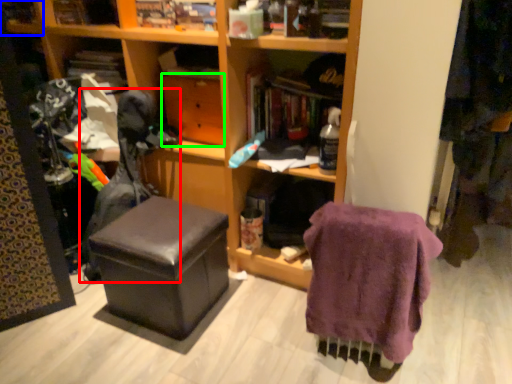
Question: Which is farther away from swivel chair (highlighted by a red box)? shelf (highlighted by a blue box) or drawer (highlighted by a green box)?

Choices:
 (A) shelf
 (B) drawer

Answer: (A)